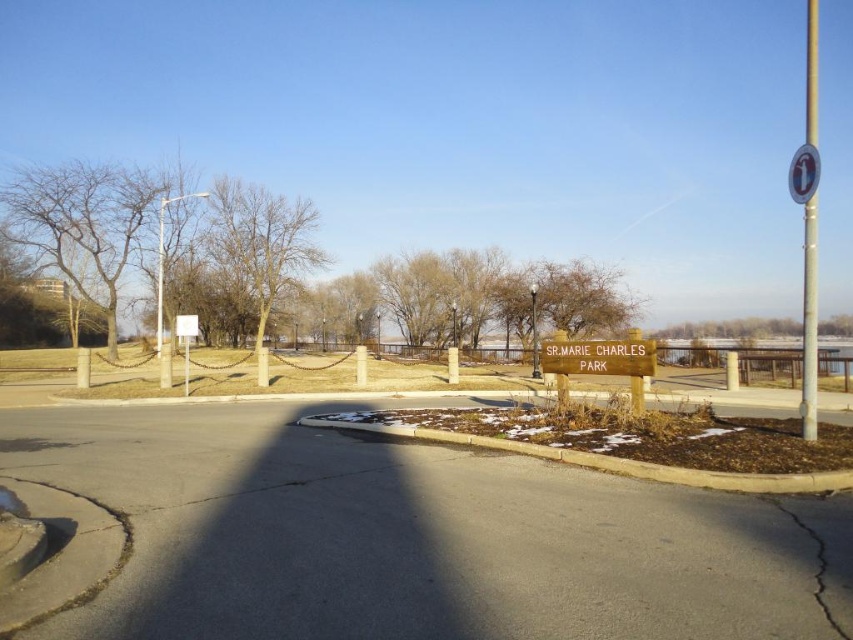
Is point (815, 241) farther from viewer compared to point (808, 164)?

No, (815, 241) is closer to viewer.

Where is `metallic pole at right`? metallic pole at right is located at coordinates (809, 321).

Between brown mulch at lower center and brown wooden sign at center, which one is positioned higher?

brown wooden sign at center is above.

Is brown mulch at lower center wider than brown wooden sign at center?

Correct, the width of brown mulch at lower center exceeds that of brown wooden sign at center.

Which is in front, point (527, 452) or point (622, 353)?

Positioned in front is point (527, 452).

Image resolution: width=853 pixels, height=640 pixels. Find the location of `brown mulch at lower center`. brown mulch at lower center is located at coordinates (616, 461).

Identify the location of bare branches at left. (86, 225).

Can you confirm if bare branches at left is smaller than metallic pole at right?

Yes.

The image size is (853, 640). Find the location of `bare branches at left`. bare branches at left is located at coordinates (86, 225).

Find the location of a particular element. This screenshot has height=640, width=853. bare branches at left is located at coordinates (86, 225).